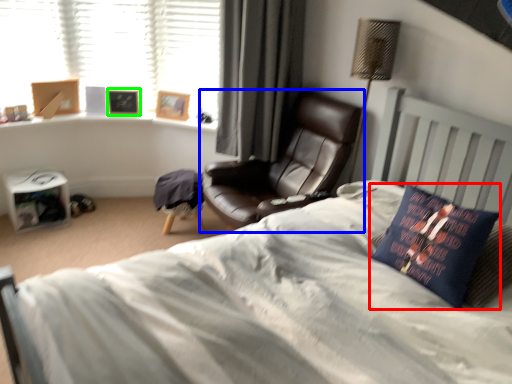
Question: Estimate the real-world distances between objects in this image. Which object is closer to pillow (highlighted by a red box), chair (highlighted by a blue box) or picture frame (highlighted by a green box)?

Choices:
 (A) chair
 (B) picture frame

Answer: (A)